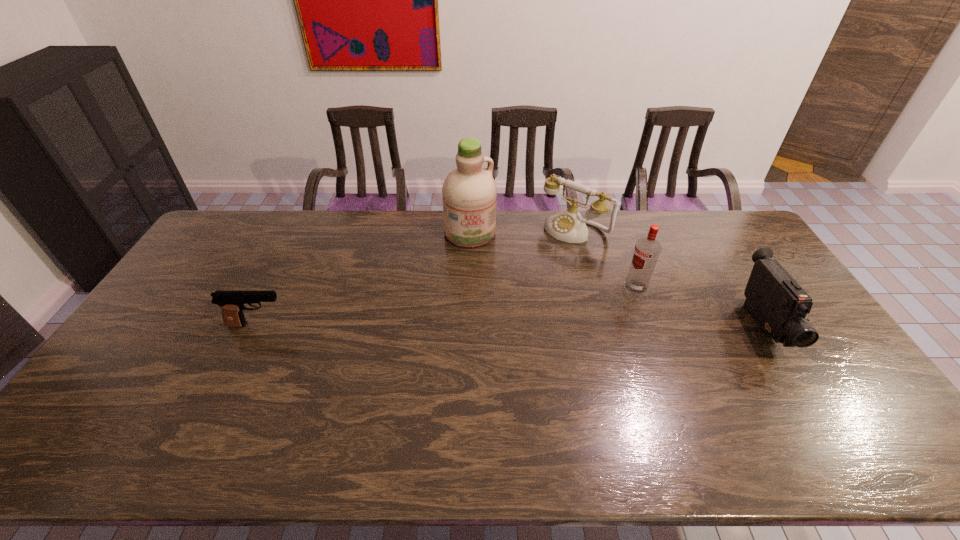
I want to click on object situated at the right edge, so click(x=778, y=303).

You are a GUI agent. You are given a task and a screenshot of the screen. Output one action in this format:
    pyautogui.click(x=<x>, y=<y>)
    Task: Click on the free region at the far edge
    Image resolution: width=960 pixels, height=540 pixels.
    Given the screenshot: What is the action you would take?
    pyautogui.click(x=408, y=238)

This screenshot has width=960, height=540. I want to click on vacant space at the near edge, so click(x=359, y=391).

Where is `blank space at the left edge of the desktop`? This screenshot has height=540, width=960. blank space at the left edge of the desktop is located at coordinates (162, 362).

Locate an element on the screen. Image resolution: width=960 pixels, height=540 pixels. vacant area at the far left corner is located at coordinates (258, 221).

This screenshot has height=540, width=960. I want to click on vacant space in between the rightmost object and the telephone, so click(668, 277).

The image size is (960, 540). Find the location of `free point between the rightmost object and the cleansing agent`. free point between the rightmost object and the cleansing agent is located at coordinates pyautogui.click(x=616, y=279).

Locate an element on the screen. The height and width of the screenshot is (540, 960). blank region between the pistol and the camcorder is located at coordinates (510, 325).

At what (x,y) coordinates should I click in order to perform the action: click on blank region between the second tallest object and the cleansing agent. Please return your answer as a coordinate pair (x, y). This screenshot has width=960, height=540. Looking at the image, I should click on (553, 260).

This screenshot has height=540, width=960. I want to click on free space that is in between the rightmost object and the telephone, so click(668, 277).